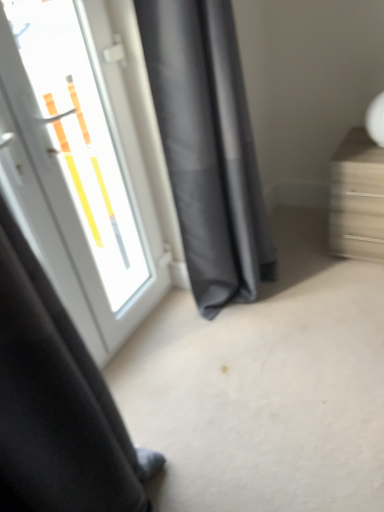
Question: Can you confirm if white glossy door at upper left is bigger than wooden drawer at right?

Choices:
 (A) no
 (B) yes

Answer: (B)

Question: Considering the relative sizes of white glossy door at upper left and wooden drawer at right in the image provided, is white glossy door at upper left smaller than wooden drawer at right?

Choices:
 (A) no
 (B) yes

Answer: (A)

Question: Is the position of white glossy door at upper left less distant than that of wooden drawer at right?

Choices:
 (A) no
 (B) yes

Answer: (B)

Question: From the image's perspective, would you say white glossy door at upper left is shown under wooden drawer at right?

Choices:
 (A) no
 (B) yes

Answer: (B)

Question: Would you say white glossy door at upper left contains wooden drawer at right?

Choices:
 (A) yes
 (B) no

Answer: (B)

Question: Is point (372, 224) closer or farther from the camera than point (205, 309)?

Choices:
 (A) farther
 (B) closer

Answer: (B)

Question: From the image's perspective, is wooden drawer at right positioned above or below dark gray fabric curtain at center?

Choices:
 (A) above
 (B) below

Answer: (B)

Question: Considering the positions of wooden drawer at right and dark gray fabric curtain at center in the image, is wooden drawer at right taller or shorter than dark gray fabric curtain at center?

Choices:
 (A) short
 (B) tall

Answer: (A)

Question: Visually, is wooden drawer at right positioned to the left or to the right of dark gray fabric curtain at center?

Choices:
 (A) right
 (B) left

Answer: (A)

Question: Considering the relative positions of dark gray fabric curtain at center and white glossy door at upper left in the image provided, is dark gray fabric curtain at center to the left or to the right of white glossy door at upper left?

Choices:
 (A) right
 (B) left

Answer: (A)

Question: From their relative heights in the image, would you say dark gray fabric curtain at center is taller or shorter than white glossy door at upper left?

Choices:
 (A) tall
 (B) short

Answer: (B)

Question: Choose the correct answer: Is dark gray fabric curtain at center inside white glossy door at upper left or outside it?

Choices:
 (A) inside
 (B) outside

Answer: (B)

Question: Looking at the image, does dark gray fabric curtain at center seem bigger or smaller compared to white glossy door at upper left?

Choices:
 (A) big
 (B) small

Answer: (A)

Question: From the image's perspective, is white glossy door at upper left above or below wooden drawer at right?

Choices:
 (A) below
 (B) above

Answer: (A)

Question: Is point (8, 60) positioned closer to the camera than point (340, 228)?

Choices:
 (A) farther
 (B) closer

Answer: (B)